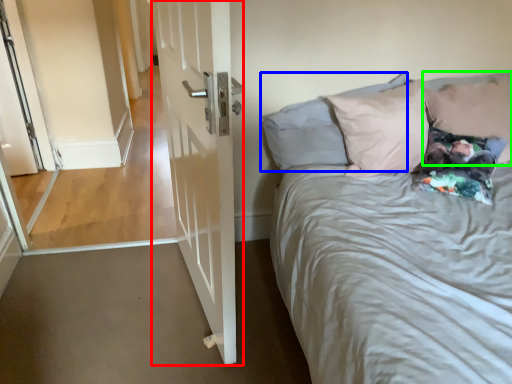
Question: Estimate the real-world distances between objects in this image. Which object is closer to door (highlighted by a red box), pillow (highlighted by a blue box) or pillow (highlighted by a green box)?

Choices:
 (A) pillow
 (B) pillow

Answer: (A)